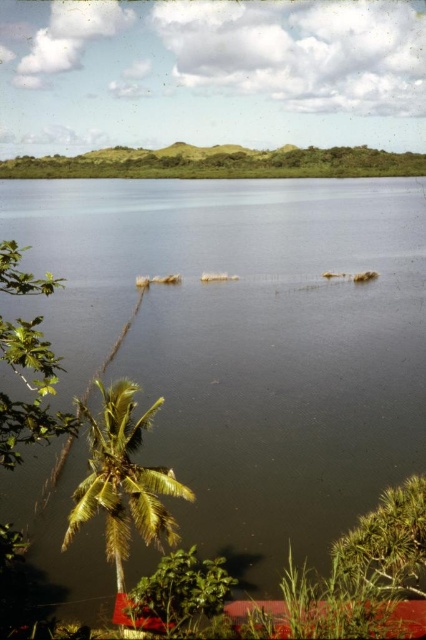
Question: Can you confirm if greenish-brown water at center is positioned below green leafy palm tree at lower left?

Choices:
 (A) yes
 (B) no

Answer: (B)

Question: Which object appears farthest from the camera in this image?

Choices:
 (A) green leafy tree at lower left
 (B) greenish-brown water at center

Answer: (B)

Question: Which of the following is the farthest from the observer?

Choices:
 (A) green leafy tree at lower left
 (B) greenish-brown water at center

Answer: (B)

Question: Which point is closer to the camera taking this photo?

Choices:
 (A) (3, 500)
 (B) (17, 416)
 (C) (106, 506)

Answer: (B)

Question: Where is green leafy palm tree at lower left located in relation to green leafy tree at lower left in the image?

Choices:
 (A) below
 (B) above

Answer: (A)

Question: Does greenish-brown water at center appear under green leafy palm tree at lower left?

Choices:
 (A) no
 (B) yes

Answer: (A)